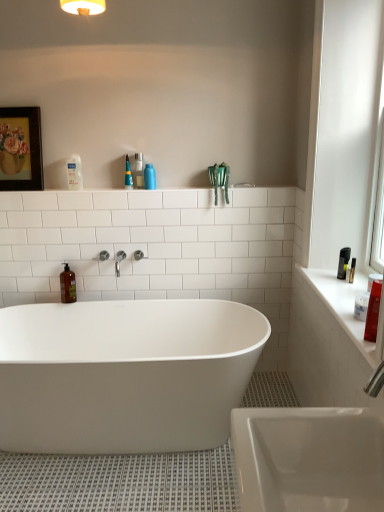
The height and width of the screenshot is (512, 384). Describe the element at coordinates (124, 374) in the screenshot. I see `white glossy bathtub at center` at that location.

Measure the distance between point (x=126, y=178) and camera.

The depth of point (x=126, y=178) is 8.10 feet.

Where is `clear plastic bottle at upper left, which is the second toiletry from right to left`? clear plastic bottle at upper left, which is the second toiletry from right to left is located at coordinates point(74,172).

Describe the element at coordinates (373, 311) in the screenshot. The height and width of the screenshot is (512, 384). I see `matte red bottle at right, the first cleaning product when ordered from right to left` at that location.

This screenshot has height=512, width=384. In order to click on white glossy bathtub at center in this screenshot , I will do `click(124, 374)`.

Which of these two, white glossy bathtub at center or clear plastic bottle at upper left, which is the second toiletry from right to left, is bigger?

white glossy bathtub at center is bigger.

Is white glossy bathtub at center in front of or behind clear plastic bottle at upper left, which is the second toiletry from right to left, in the image?

white glossy bathtub at center is positioned closer to the viewer than clear plastic bottle at upper left, which is the second toiletry from right to left.

In terms of width, does white glossy bathtub at center look wider or thinner when compared to clear plastic bottle at upper left, which appears as the first toiletry when viewed from the left?

In the image, white glossy bathtub at center appears to be wider than clear plastic bottle at upper left, which appears as the first toiletry when viewed from the left.

Is white glossy bathtub at center placed right next to clear plastic bottle at upper left, which is the second toiletry from right to left?

white glossy bathtub at center and clear plastic bottle at upper left, which is the second toiletry from right to left, are clearly separated.

Is white glossy bathtub at center placed right next to translucent plastic spray bottle at upper center, marked as the second cleaning product in a back-to-front arrangement?

No, white glossy bathtub at center is not with translucent plastic spray bottle at upper center, marked as the second cleaning product in a back-to-front arrangement.

Is point (209, 412) positioned before point (130, 186)?

Yes, point (209, 412) is in front of point (130, 186).

In the scene shown: Considering the relative positions of white glossy bathtub at center and translucent plastic spray bottle at upper center, arranged as the first cleaning product when viewed from the top, in the image provided, is white glossy bathtub at center to the left of translucent plastic spray bottle at upper center, arranged as the first cleaning product when viewed from the top, from the viewer's perspective?

Yes, white glossy bathtub at center is to the left of translucent plastic spray bottle at upper center, arranged as the first cleaning product when viewed from the top.

Which object is closer to the camera taking this photo, white glossy bathtub at center or translucent plastic spray bottle at upper center, placed as the 3th cleaning product when sorted from right to left?

white glossy bathtub at center.

Can you confirm if white glossy window sill at right is thinner than clear plastic bottle at upper center, placed as the second toiletry when sorted from left to right?

Yes.

From the image's perspective, is white glossy window sill at right on clear plastic bottle at upper center, acting as the 1th toiletry starting from the right?

No, from the image's perspective, white glossy window sill at right is not on top of clear plastic bottle at upper center, acting as the 1th toiletry starting from the right.

Does point (371, 74) lie behind point (141, 154)?

No, it is not.

Considering the relative sizes of white glossy window sill at right and clear plastic bottle at upper center, acting as the 1th toiletry starting from the right, in the image provided, is white glossy window sill at right shorter than clear plastic bottle at upper center, acting as the 1th toiletry starting from the right,?

Incorrect, the height of white glossy window sill at right does not fall short of that of clear plastic bottle at upper center, acting as the 1th toiletry starting from the right.

Are white glossy bathtub at center and white glossy counter top at right far apart?

Actually, white glossy bathtub at center and white glossy counter top at right are a little close together.

Is point (113, 304) less distant than point (369, 342)?

No, (113, 304) is further to viewer.

Is white glossy bathtub at center to the left or to the right of white glossy counter top at right in the image?

white glossy bathtub at center is to the left of white glossy counter top at right.

From the image's perspective, who appears lower, white glossy bathtub at center or white glossy counter top at right?

white glossy bathtub at center.

Is clear plastic bottle at upper center, placed as the second toiletry when sorted from left to right, taller or shorter than white glossy window sill at right?

Clearly, clear plastic bottle at upper center, placed as the second toiletry when sorted from left to right, is shorter compared to white glossy window sill at right.

Looking at this image, from a real-world perspective, is clear plastic bottle at upper center, placed as the second toiletry when sorted from left to right, positioned over white glossy window sill at right based on gravity?

Actually, clear plastic bottle at upper center, placed as the second toiletry when sorted from left to right, is physically below white glossy window sill at right in the real world.

Is clear plastic bottle at upper center, acting as the 1th toiletry starting from the right, not near white glossy window sill at right?

Indeed, clear plastic bottle at upper center, acting as the 1th toiletry starting from the right, is not near white glossy window sill at right.

Can you confirm if clear plastic bottle at upper center, placed as the second toiletry when sorted from left to right, is bigger than white glossy window sill at right?

Actually, clear plastic bottle at upper center, placed as the second toiletry when sorted from left to right, might be smaller than white glossy window sill at right.

Considering their positions, is polished chrome faucet at center located in front of or behind translucent plastic spray bottle at upper center, arranged as the first cleaning product when viewed from the top?

polished chrome faucet at center is positioned closer to the viewer than translucent plastic spray bottle at upper center, arranged as the first cleaning product when viewed from the top.

Locate an element on the screen. The height and width of the screenshot is (512, 384). tap that appears below the translucent plastic spray bottle at upper center, placed as the 3th cleaning product when sorted from right to left (from a real-world perspective) is located at coordinates (119, 261).

Are polished chrome faucet at center and translucent plastic spray bottle at upper center, the 3th cleaning product from the front, beside each other?

No, polished chrome faucet at center is not touching translucent plastic spray bottle at upper center, the 3th cleaning product from the front.

Is polished chrome faucet at center completely or partially outside of translucent plastic spray bottle at upper center, the second cleaning product from the left?

Yes, polished chrome faucet at center is not within translucent plastic spray bottle at upper center, the second cleaning product from the left.

Is wooden framed painting at upper left to the left or to the right of blue matte bottle at upper center, the 2th cleaning product positioned from the front, in the image?

Clearly, wooden framed painting at upper left is on the left of blue matte bottle at upper center, the 2th cleaning product positioned from the front, in the image.

The width and height of the screenshot is (384, 512). Identify the location of picture frame in front of the blue matte bottle at upper center, which is the third cleaning product in left-to-right order. (21, 149).

Is wooden framed painting at upper left next to blue matte bottle at upper center, which is the third cleaning product in left-to-right order, and touching it?

No, wooden framed painting at upper left is not making contact with blue matte bottle at upper center, which is the third cleaning product in left-to-right order.

Find the location of a particular element. The height and width of the screenshot is (512, 384). bathtub below the clear plastic bottle at upper left, which appears as the first toiletry when viewed from the left (from the image's perspective) is located at coordinates coord(124,374).

At what (x,y) coordinates should I click in order to perform the action: click on the 4th cleaning product located above the white glossy bathtub at center (from a real-world perspective). Please return your answer as a coordinate pair (x, y). Looking at the image, I should click on (128, 175).

Based on their spatial positions, is clear plastic bottle at upper left, which appears as the first toiletry when viewed from the left, or white glossy bathtub at center closer to brown matte bottle at left, the third cleaning product in the top-to-bottom sequence?

clear plastic bottle at upper left, which appears as the first toiletry when viewed from the left, is positioned closer to the anchor brown matte bottle at left, the third cleaning product in the top-to-bottom sequence.

Which object lies nearer to the anchor point translucent plastic spray bottle at upper center, marked as the second cleaning product in a back-to-front arrangement, clear plastic bottle at upper center, placed as the second toiletry when sorted from left to right, or blue matte bottle at upper center, which is counted as the third cleaning product, starting from the bottom?

The object closer to translucent plastic spray bottle at upper center, marked as the second cleaning product in a back-to-front arrangement, is clear plastic bottle at upper center, placed as the second toiletry when sorted from left to right.

Considering their positions, is white glossy window sill at right positioned closer to clear plastic bottle at upper left, which is the second toiletry from right to left, than polished chrome faucet at center?

Based on the image, polished chrome faucet at center appears to be nearer to clear plastic bottle at upper left, which is the second toiletry from right to left.

When comparing their distances from matte red bottle at right, the 4th cleaning product in the back-to-front sequence, does clear plastic bottle at upper left, which appears as the first toiletry when viewed from the left, or white glossy window sill at right seem closer?

Among the two, white glossy window sill at right is located nearer to matte red bottle at right, the 4th cleaning product in the back-to-front sequence.

Considering their positions, is clear plastic bottle at upper left, which is the second toiletry from right to left, positioned closer to translucent plastic spray bottle at upper center, the 3th cleaning product from the front, than wooden framed painting at upper left?

clear plastic bottle at upper left, which is the second toiletry from right to left.

From the image, which object appears to be farther from white glossy counter top at right, matte red bottle at right, arranged as the fourth cleaning product when viewed from the top, or blue matte bottle at upper center, which is counted as the third cleaning product, starting from the bottom?

blue matte bottle at upper center, which is counted as the third cleaning product, starting from the bottom, is positioned further to the anchor white glossy counter top at right.

Looking at the image, which one is located closer to matte red bottle at right, which is counted as the fourth cleaning product, starting from the left, polished chrome faucet at center or clear plastic bottle at upper center, placed as the second toiletry when sorted from left to right?

polished chrome faucet at center is closer to matte red bottle at right, which is counted as the fourth cleaning product, starting from the left.

From the image, which object appears to be nearer to clear plastic bottle at upper left, which appears as the first toiletry when viewed from the left, white glossy counter top at right or matte red bottle at right, the first cleaning product when ordered from right to left?

Based on the image, white glossy counter top at right appears to be nearer to clear plastic bottle at upper left, which appears as the first toiletry when viewed from the left.

You are a GUI agent. You are given a task and a screenshot of the screen. Output one action in this format:
    pyautogui.click(x=<x>, y=<y>)
    Task: Click on the window located between white glossy bathtub at center and white glossy counter top at right in the left-right direction
    The height and width of the screenshot is (512, 384).
    Given the screenshot: What is the action you would take?
    pyautogui.click(x=342, y=128)

The image size is (384, 512). Find the location of `toiletry between clear plastic bottle at upper left, which appears as the first toiletry when viewed from the left, and blue matte bottle at upper center, which is counted as the 3th cleaning product, starting from the back`. toiletry between clear plastic bottle at upper left, which appears as the first toiletry when viewed from the left, and blue matte bottle at upper center, which is counted as the 3th cleaning product, starting from the back is located at coordinates (139, 170).

You are a GUI agent. You are given a task and a screenshot of the screen. Output one action in this format:
    pyautogui.click(x=<x>, y=<y>)
    Task: Click on the toiletry between white glossy window sill at right and translucent plastic spray bottle at upper center, arranged as the first cleaning product when viewed from the top, in the front-back direction
    Image resolution: width=384 pixels, height=512 pixels.
    Given the screenshot: What is the action you would take?
    pyautogui.click(x=74, y=172)

Identify the location of tap between wooden framed painting at upper left and matte red bottle at right, the 4th cleaning product in the back-to-front sequence, in the horizontal direction. (119, 261).